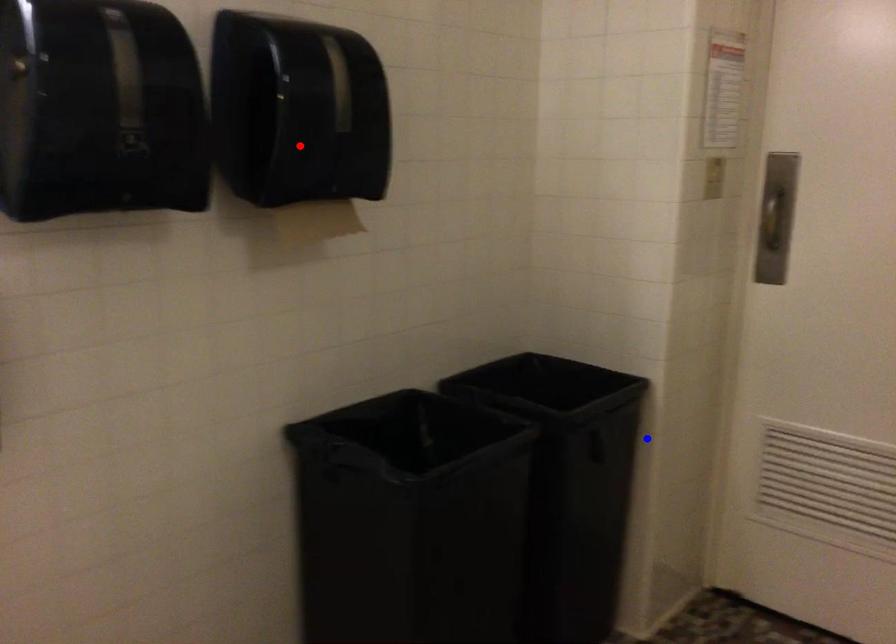
Question: In the image, two points are highlighted. Which point is nearer to the camera? Reply with the corresponding letter.

Choices:
 (A) blue point
 (B) red point

Answer: (B)